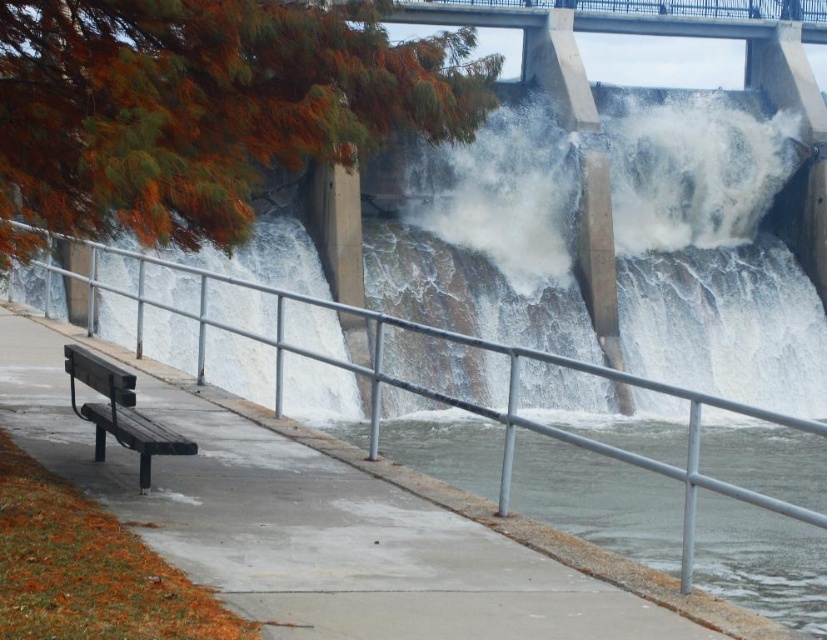
Question: From the image, what is the correct spatial relationship of metal/smooth rail at left in relation to wooden bench at left?

Choices:
 (A) right
 (B) left

Answer: (A)

Question: Which of these objects is positioned closest to the metal/smooth rail at left?

Choices:
 (A) clear concrete water at lower center
 (B) wooden bench at left

Answer: (A)

Question: Considering the relative positions of clear concrete water at lower center and metal/smooth rail at left in the image provided, where is clear concrete water at lower center located with respect to metal/smooth rail at left?

Choices:
 (A) right
 (B) left

Answer: (A)

Question: Which point is closer to the camera?

Choices:
 (A) (792, 536)
 (B) (373, 333)
 (C) (98, 454)

Answer: (C)

Question: Among these points, which one is nearest to the camera?

Choices:
 (A) (280, 369)
 (B) (88, 374)
 (C) (797, 586)

Answer: (B)

Question: Can you confirm if clear concrete water at lower center is thinner than wooden bench at left?

Choices:
 (A) yes
 (B) no

Answer: (B)